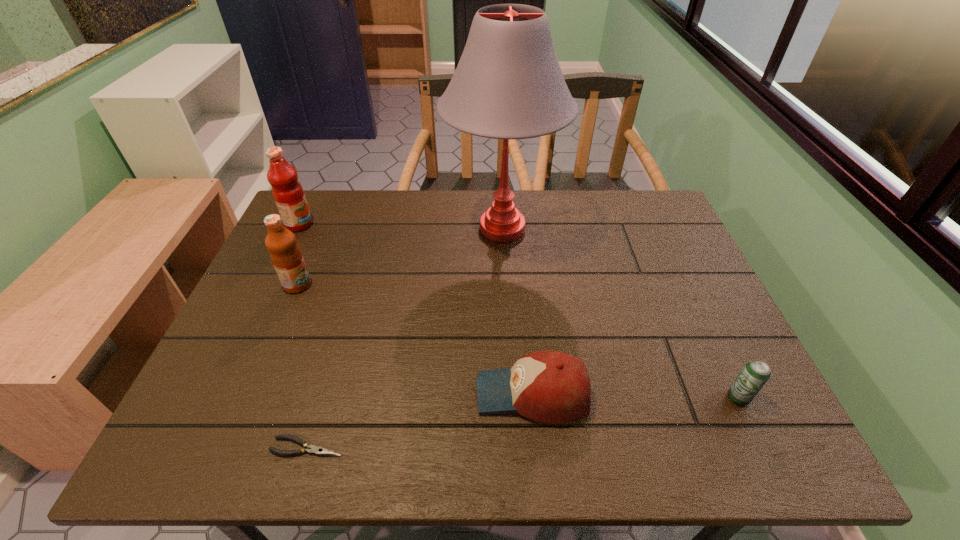
I want to click on table lamp, so click(x=508, y=84).

Locate an element on the screen. This screenshot has height=540, width=960. the farther fruit juice is located at coordinates (287, 191).

You are a GUI agent. You are given a task and a screenshot of the screen. Output one action in this format:
    pyautogui.click(x=<x>, y=<y>)
    Task: Click on the shorter fruit juice
    The width and height of the screenshot is (960, 540).
    Given the screenshot: What is the action you would take?
    pyautogui.click(x=286, y=256)

You are a GUI agent. You are given a task and a screenshot of the screen. Output one action in this format:
    pyautogui.click(x=<x>, y=<y>)
    Task: Click on the nearer fruit juice
    The height and width of the screenshot is (540, 960).
    Given the screenshot: What is the action you would take?
    pyautogui.click(x=286, y=256)

Locate an element on the screen. The image size is (960, 540). the rightmost object is located at coordinates (754, 375).

Identify the location of baseball cap. The width and height of the screenshot is (960, 540). pyautogui.click(x=553, y=387).

Image resolution: width=960 pixels, height=540 pixels. I want to click on the nearest object, so click(311, 449).

Identify the location of the shortest object. pos(311,449).

Where is `blank space located on the front-facing side of the table lamp`? Image resolution: width=960 pixels, height=540 pixels. blank space located on the front-facing side of the table lamp is located at coordinates (511, 378).

At what (x,y) coordinates should I click in order to perform the action: click on free spot located on the front label of the farther fruit juice. Please return your answer as a coordinate pair (x, y). The width and height of the screenshot is (960, 540). Looking at the image, I should click on (420, 225).